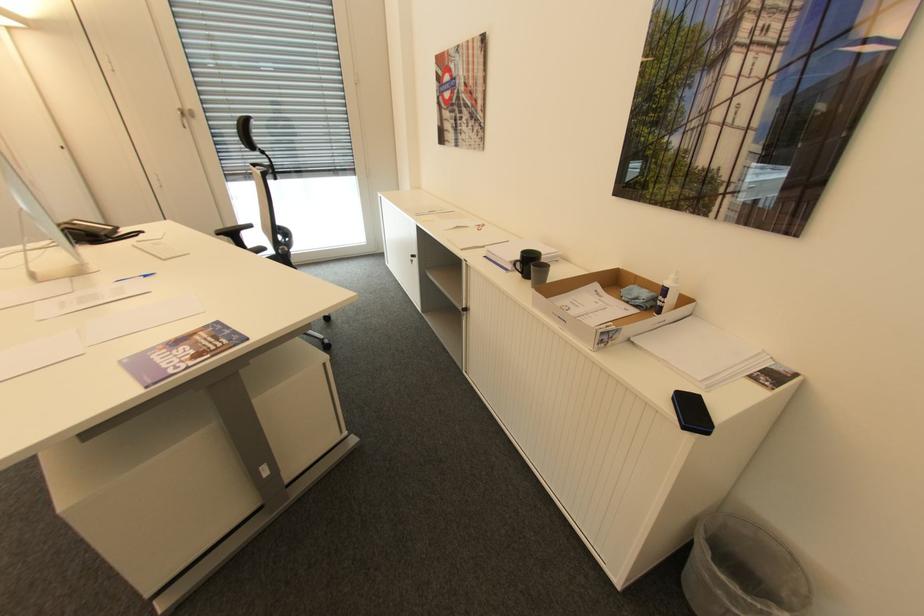
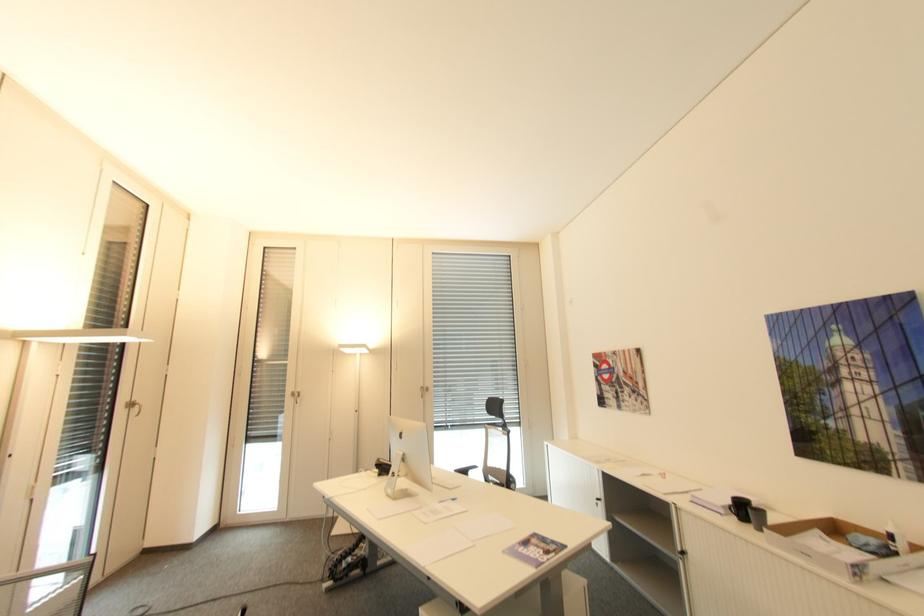
Find the pixel in the second image that matches (x=550, y=268) in the first image.

(766, 513)